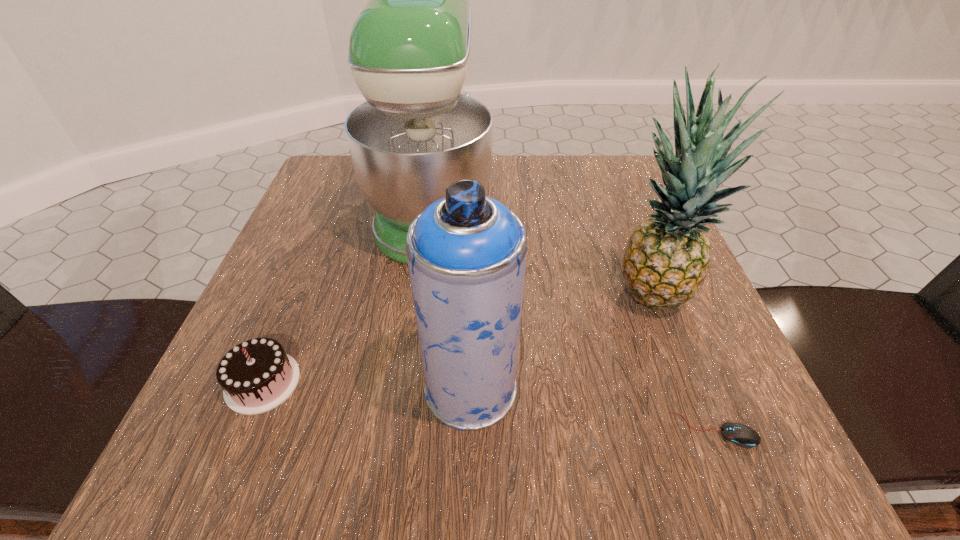
Identify the location of mixer. The height and width of the screenshot is (540, 960). (419, 131).

Image resolution: width=960 pixels, height=540 pixels. What are the coordinates of `pineapple` in the screenshot? It's located at (667, 257).

The height and width of the screenshot is (540, 960). I want to click on aerosol can, so click(x=466, y=253).

Where is `chocolate cake`? This screenshot has height=540, width=960. chocolate cake is located at coordinates (257, 375).

You are a GUI agent. You are given a task and a screenshot of the screen. Output one action in this format:
    pyautogui.click(x=<x>, y=<y>)
    Task: Click on the leftmost object
    This screenshot has width=960, height=540.
    Given the screenshot: What is the action you would take?
    pyautogui.click(x=257, y=375)

The height and width of the screenshot is (540, 960). Identify the location of mouse. (742, 435).

Find the location of `vacant area located on the controls of the mixer`. vacant area located on the controls of the mixer is located at coordinates (562, 206).

Locate an element on the screen. Image resolution: width=960 pixels, height=540 pixels. free spot located 0.140m on the front of the pineapple is located at coordinates (689, 403).

Where is `free space located on the right of the aerosol can`? The image size is (960, 540). free space located on the right of the aerosol can is located at coordinates 696,388.

Locate an element on the screen. The height and width of the screenshot is (540, 960). vacant area located on the back of the chocolate cake is located at coordinates (334, 208).